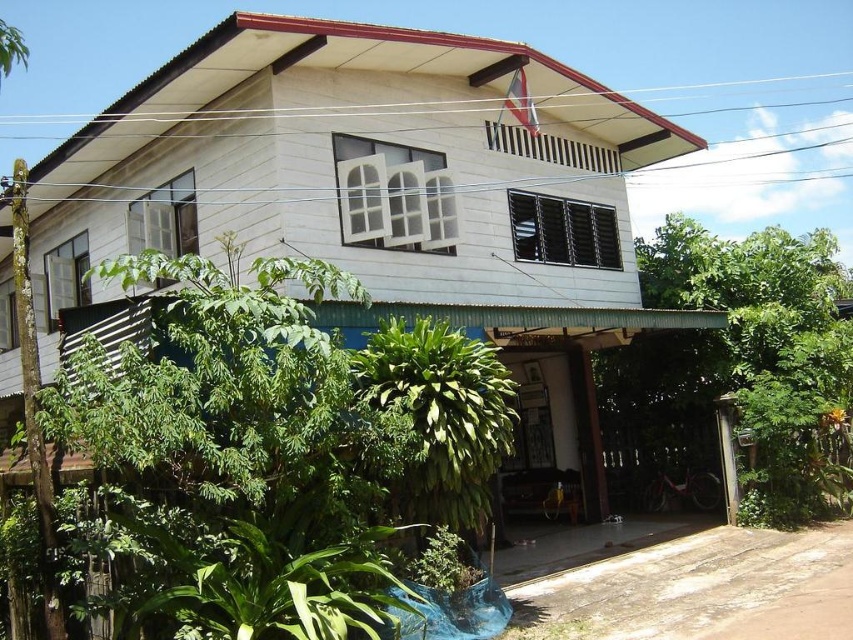
Is green leafy plant at lower right above green leafy plant at lower center?

Yes.

Between point (720, 253) and point (492, 448), which one is positioned behind?

Positioned behind is point (720, 253).

You are a GUI agent. You are given a task and a screenshot of the screen. Output one action in this format:
    pyautogui.click(x=<x>, y=<y>)
    Task: Click on the green leafy plant at lower right
    
    Given the screenshot: What is the action you would take?
    pyautogui.click(x=767, y=356)

Is green leafy plant at left smaller than green leafy plant at lower right?

Yes, green leafy plant at left is smaller than green leafy plant at lower right.

Between point (318, 269) and point (758, 506), which one is positioned behind?

The point (758, 506) is behind.

This screenshot has height=640, width=853. Identify the location of green leafy plant at left. (279, 458).

Is point (194, 515) closer to camera compared to point (502, 397)?

Yes, it is in front of point (502, 397).

Does green leafy plant at left have a lesser width compared to green leafy plant at lower center?

Incorrect, green leafy plant at left's width is not less than green leafy plant at lower center's.

The width and height of the screenshot is (853, 640). Describe the element at coordinates (279, 458) in the screenshot. I see `green leafy plant at left` at that location.

At what (x,y) coordinates should I click in order to perform the action: click on green leafy plant at left. Please return your answer as a coordinate pair (x, y). This screenshot has height=640, width=853. Looking at the image, I should click on (279, 458).